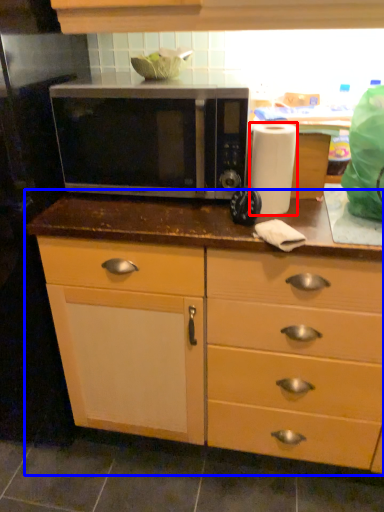
Question: Which object appears farthest to the camera in this image, paper towel (highlighted by a red box) or cabinetry (highlighted by a blue box)?

Choices:
 (A) paper towel
 (B) cabinetry

Answer: (A)